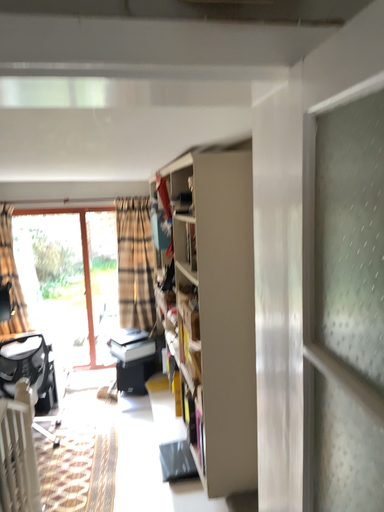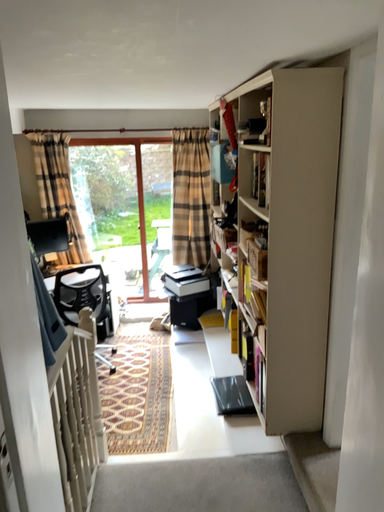
Question: How did the camera likely rotate when shooting the video?

Choices:
 (A) rotated downward
 (B) rotated upward

Answer: (A)